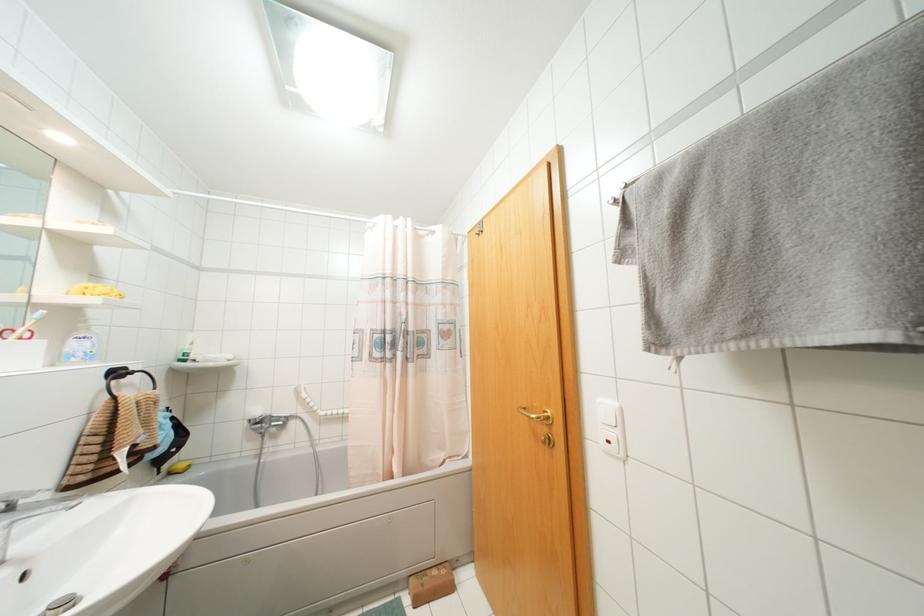
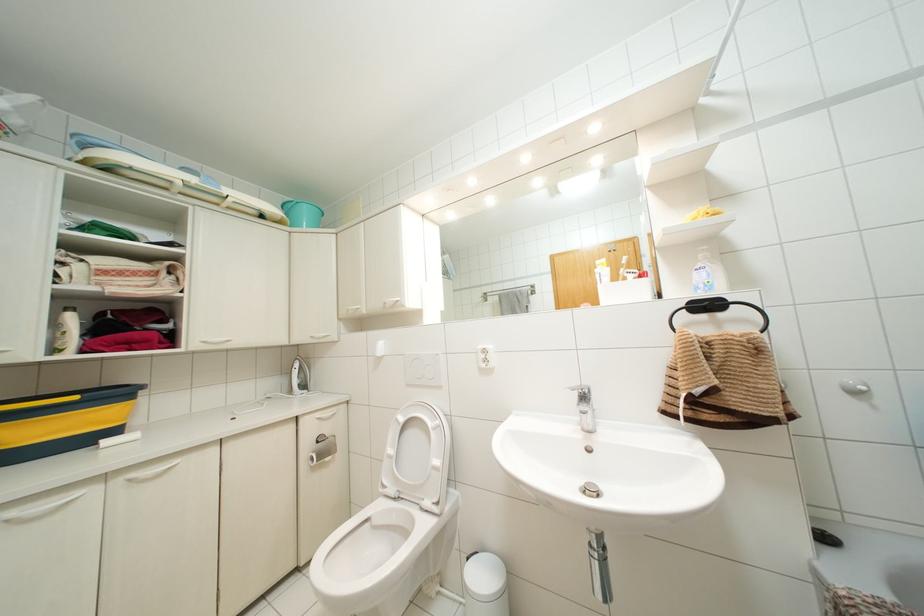
The point at (88,344) is marked in the first image. Where is the corresponding point in the second image?

(703, 274)